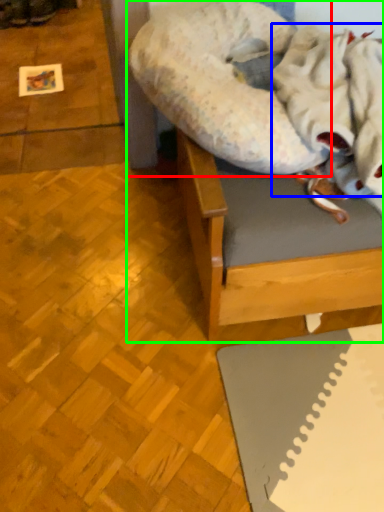
Question: Based on their relative distances, which object is farther from dog bed (highlighted by a red box)? Choose from blanket (highlighted by a blue box) and furniture (highlighted by a green box).

Choices:
 (A) blanket
 (B) furniture

Answer: (A)